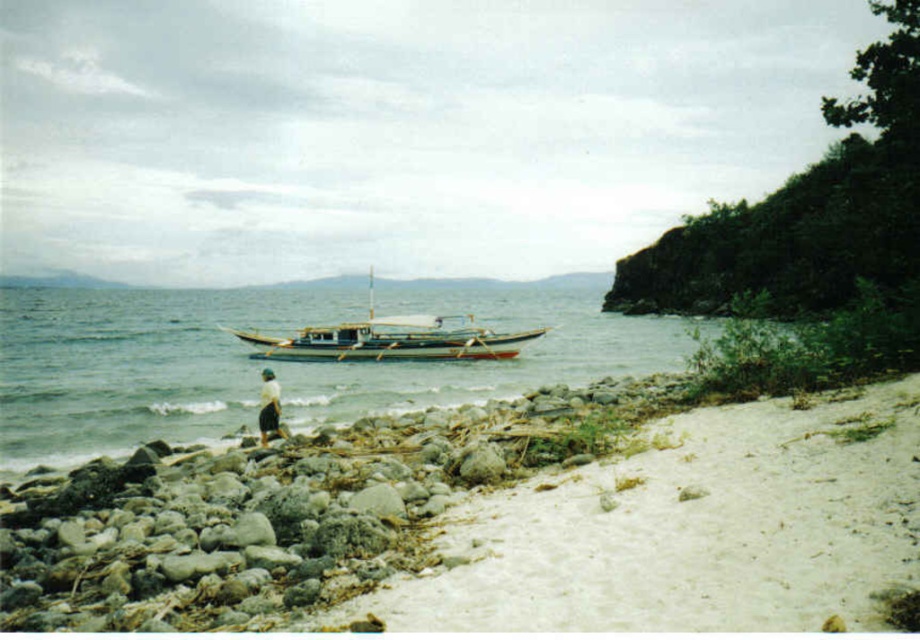
At what (x,y) coordinates should I click in order to perform the action: click on white sandy beach at lower right. Please return your answer as a coordinate pair (x, y). The height and width of the screenshot is (640, 920). Looking at the image, I should click on (686, 529).

Which is behind, point (552, 502) or point (260, 406)?

The point (260, 406) is behind.

The width and height of the screenshot is (920, 640). I want to click on white sandy beach at lower right, so click(x=686, y=529).

Find the location of `white sandy beach at lower right`. white sandy beach at lower right is located at coordinates (686, 529).

Does wooden boat at center appear on the right side of white fabric skirt at center?

Incorrect, wooden boat at center is not on the right side of white fabric skirt at center.

Which is behind, point (535, 333) or point (274, 374)?

Point (535, 333)

Find the location of a particular element. Image resolution: width=920 pixels, height=640 pixels. wooden boat at center is located at coordinates (391, 339).

Who is higher up, smooth gray rocks at lower left or clear water at boat center?

Positioned higher is clear water at boat center.

Does point (438, 458) lie behind point (493, 284)?

No, it is not.

Is point (404, 515) positioned in front of point (349, 397)?

Yes.

Locate an element on the screen. This screenshot has height=640, width=920. smooth gray rocks at lower left is located at coordinates (282, 509).